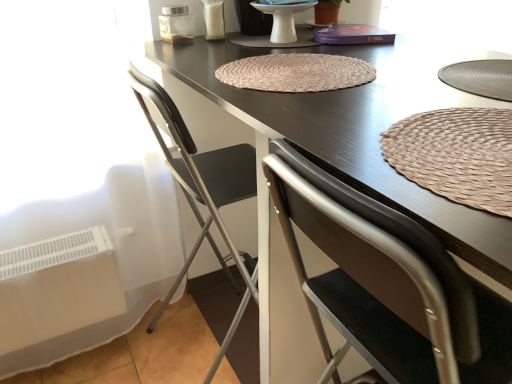
Question: From a real-world perspective, is brown woven mat at center, arranged as the first mat when viewed from the top, positioned above or below matte ceramic plate at center?

Choices:
 (A) below
 (B) above

Answer: (A)

Question: Is point click(x=356, y=72) closer or farther from the camera than point click(x=287, y=41)?

Choices:
 (A) farther
 (B) closer

Answer: (B)

Question: Estimate the real-world distances between objects in this image. Which object is closer to the brown woven mat at center, the second mat ordered from the bottom?

Choices:
 (A) metallic gray chair at left
 (B) brown woven mat at center, arranged as the 2th mat when viewed from the top
 (C) dark brown wood table at center
 (D) matte ceramic plate at center

Answer: (C)

Question: Which object is positioned farthest from the brown woven mat at center, which appears as the 2th mat when viewed from the back?

Choices:
 (A) dark brown wood table at center
 (B) matte ceramic plate at center
 (C) brown woven mat at center, placed as the first mat when sorted from back to front
 (D) metallic gray chair at left

Answer: (B)